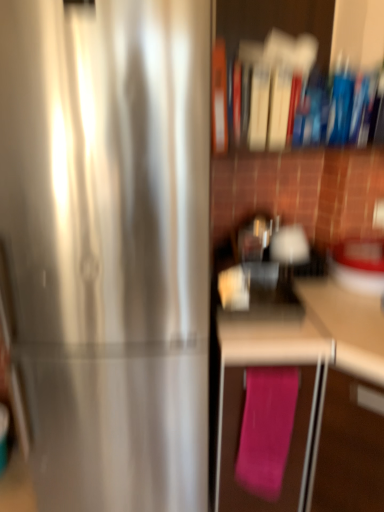
Question: From their relative heights in the image, would you say satin silver refrigerator at left is taller or shorter than pink fabric bath towel at lower right?

Choices:
 (A) short
 (B) tall

Answer: (B)

Question: From the image's perspective, is satin silver refrigerator at left positioned above or below pink fabric bath towel at lower right?

Choices:
 (A) above
 (B) below

Answer: (A)

Question: Which is nearer to the pink fabric at lower right?

Choices:
 (A) satin silver refrigerator at left
 (B) pink fabric bath towel at lower right

Answer: (B)

Question: Which is nearer to the pink fabric at lower right?

Choices:
 (A) pink fabric bath towel at lower right
 (B) satin silver refrigerator at left

Answer: (A)